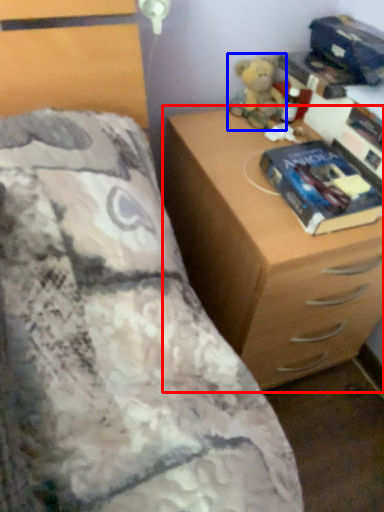
Question: Which object is further to the camera taking this photo, chest of drawers (highlighted by a red box) or toy (highlighted by a blue box)?

Choices:
 (A) chest of drawers
 (B) toy

Answer: (B)